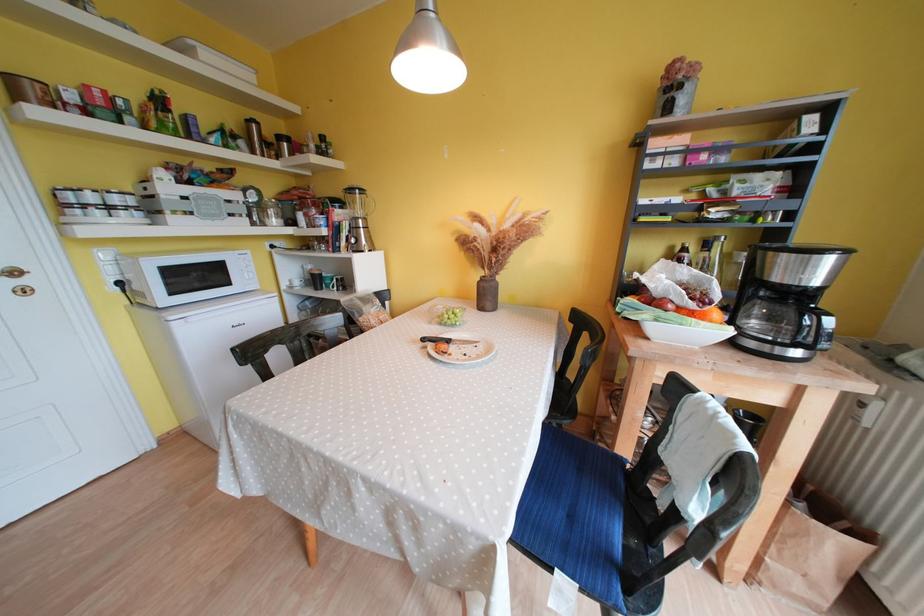
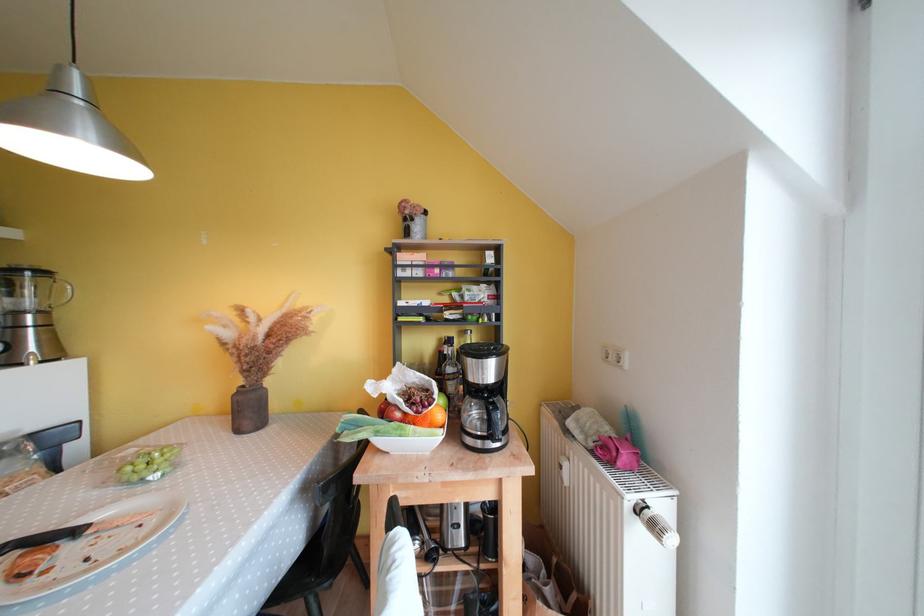
Where in the second image is the point corresponding to the point at 492,301 from the first image?

(256, 416)